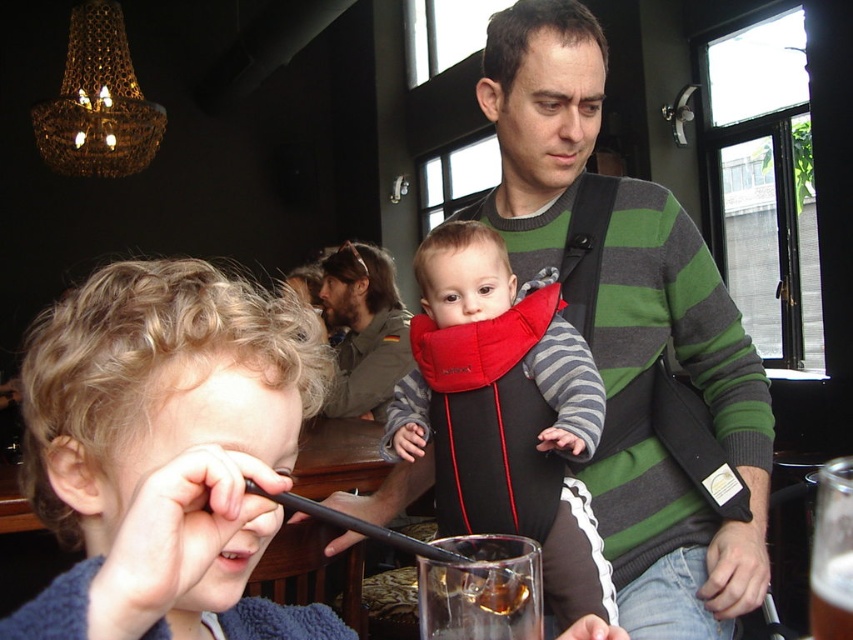
You are a parent trying to reach the translucent glass beverage at lower right while holding your baby in the striped fabric baby carrier at center. Can you easily access the beverage without putting the baby down?

The striped fabric baby carrier at center is located above the translucent glass beverage at lower right, so you can easily access the beverage without putting the baby down by reaching below the carrier.

You are a parent who wants to choose between the striped fabric baby carrier at center and the dark brown leather jacket at upper center to carry a baby. Which one is more suitable for carrying the baby?

The striped fabric baby carrier at center is more suitable for carrying the baby because it is designed for that purpose and has a smaller size compared to the dark brown leather jacket at upper center.

You are a customer in the cafe and you want to order a drink. The menu is located at point (631, 333). Can you tell me what color the menu is?

The menu at point (631, 333) is green striped sweater at center.